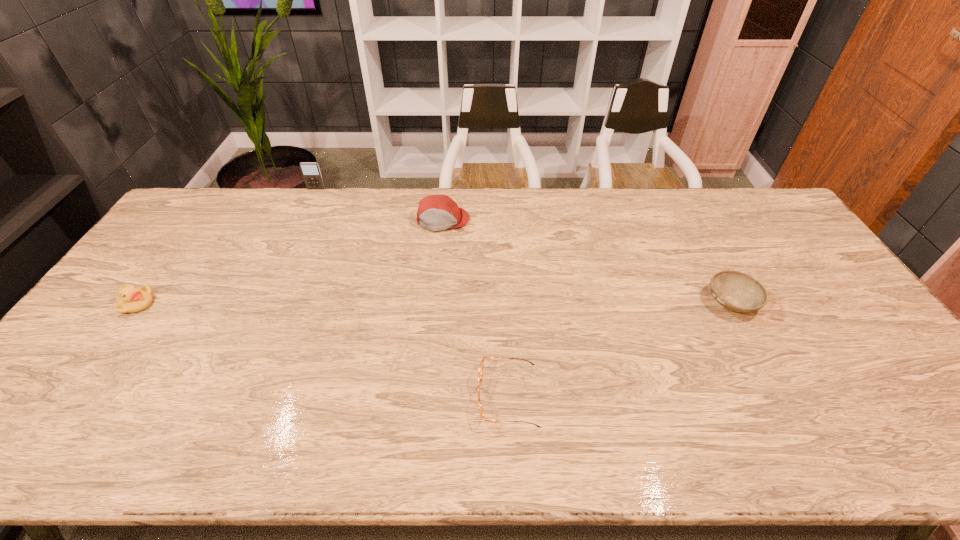
Image resolution: width=960 pixels, height=540 pixels. Find the location of `vacant region that satisfies the following two spatial constraints: 1. on the front-facing side of the bowl; 2. on the right side of the cap`. vacant region that satisfies the following two spatial constraints: 1. on the front-facing side of the bowl; 2. on the right side of the cap is located at coordinates (435, 302).

You are a GUI agent. You are given a task and a screenshot of the screen. Output one action in this format:
    pyautogui.click(x=<x>, y=<y>)
    Task: Click on the vacant region that satisfies the following two spatial constraints: 1. on the front side of the bowl; 2. on the front-facing side of the nearest object
    The width and height of the screenshot is (960, 540).
    Given the screenshot: What is the action you would take?
    pyautogui.click(x=782, y=396)

Locate an element on the screen. The height and width of the screenshot is (540, 960). vacant position in the image that satisfies the following two spatial constraints: 1. on the front-facing side of the rightmost object; 2. on the left side of the iPod is located at coordinates (264, 302).

The height and width of the screenshot is (540, 960). I want to click on free spot that satisfies the following two spatial constraints: 1. on the front side of the rightmost object; 2. on the front-facing side of the spectacles, so click(x=782, y=396).